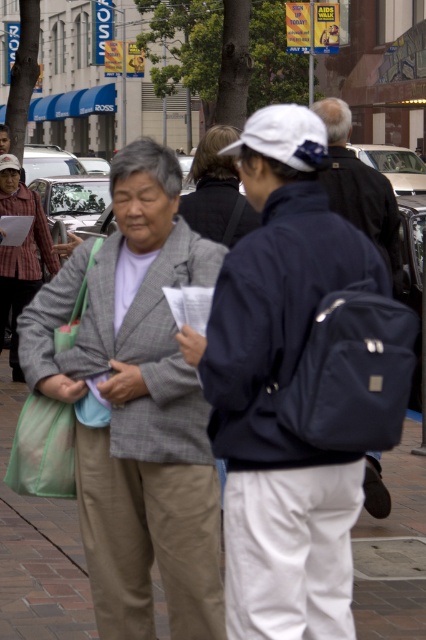
You are a delivery person trying to decide whether to place a large package on the ground between the matte blue backpack at center and the dark gray sweater at center. Based on their heights, can the package be placed there without hitting either object?

The matte blue backpack at center is much taller than the dark gray sweater at center. Since the backpack is taller, placing the package between them might still hit the taller backpack. Therefore, the package should not be placed there if it requires clearance below the backpack.

You are a pedestrian trying to cross the street and see the matte blue backpack at center and the dark gray sweater at center. Which one is more to the right?

The matte blue backpack at center is positioned on the right side of dark gray sweater at center, so it is more to the right.